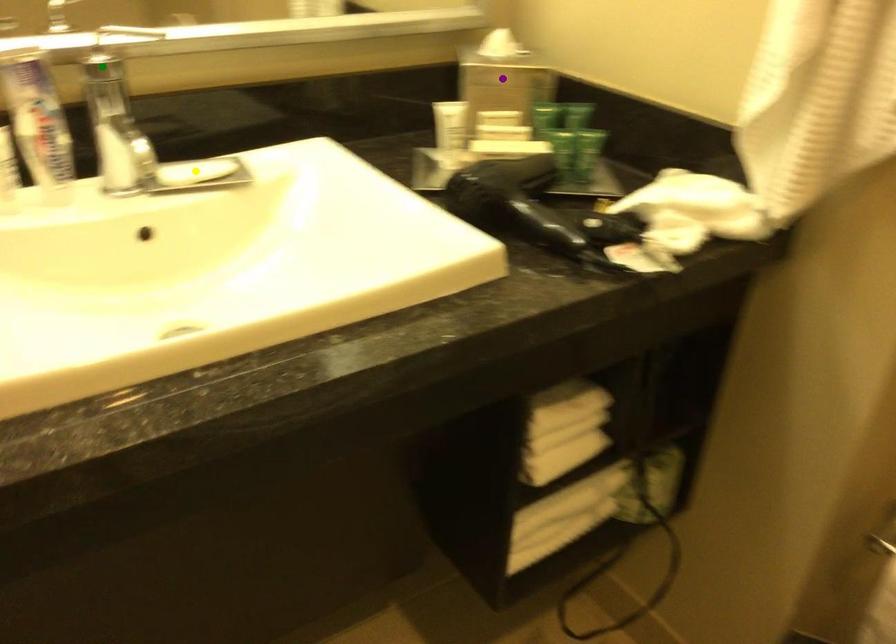
Order these from nearest to farthest:
yellow point
purple point
green point

green point < yellow point < purple point